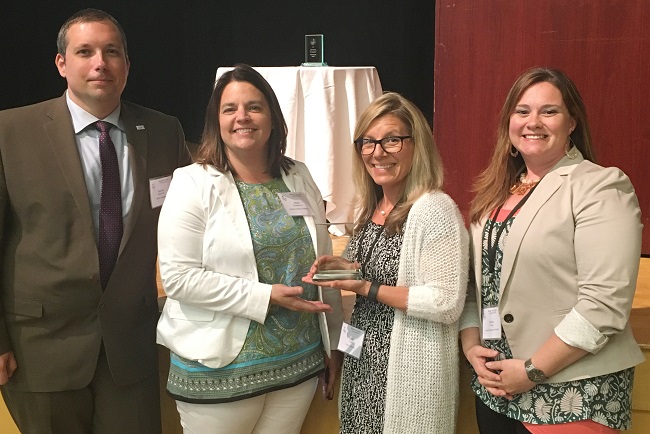
This screenshot has width=650, height=434. Identify the location of awards. (314, 52), (338, 254).